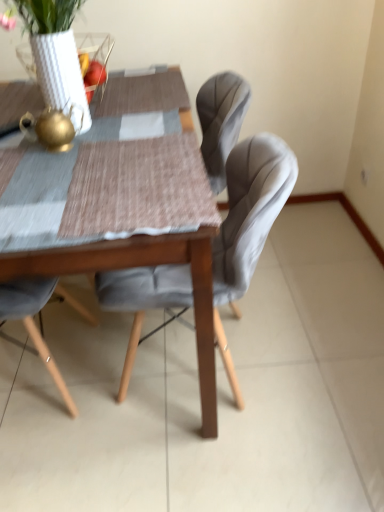
Question: Is white textured vase at upper left shorter than velvet grey chair at center?

Choices:
 (A) yes
 (B) no

Answer: (A)

Question: Is white textured vase at upper left directly adjacent to velvet grey chair at center?

Choices:
 (A) yes
 (B) no

Answer: (B)

Question: Can you confirm if white textured vase at upper left is positioned to the left of velvet grey chair at center?

Choices:
 (A) yes
 (B) no

Answer: (A)

Question: From the image's perspective, is white textured vase at upper left above velvet grey chair at center?

Choices:
 (A) no
 (B) yes

Answer: (B)

Question: Would you say white textured vase at upper left contains velvet grey chair at center?

Choices:
 (A) no
 (B) yes

Answer: (A)

Question: From a real-world perspective, is white textured vase at upper left over velvet grey chair at center?

Choices:
 (A) yes
 (B) no

Answer: (A)

Question: Would you say wooden table at center contains white textured vase at upper left?

Choices:
 (A) yes
 (B) no

Answer: (B)

Question: Does wooden table at center have a smaller size compared to white textured vase at upper left?

Choices:
 (A) no
 (B) yes

Answer: (A)

Question: Does wooden table at center come in front of white textured vase at upper left?

Choices:
 (A) no
 (B) yes

Answer: (B)

Question: From the image's perspective, does wooden table at center appear higher than white textured vase at upper left?

Choices:
 (A) no
 (B) yes

Answer: (A)

Question: Is wooden table at center positioned with its back to white textured vase at upper left?

Choices:
 (A) no
 (B) yes

Answer: (A)

Question: Is wooden table at center taller than white textured vase at upper left?

Choices:
 (A) yes
 (B) no

Answer: (A)

Question: Considering the relative positions of velvet grey chair at center and wooden table at center in the image provided, is velvet grey chair at center behind wooden table at center?

Choices:
 (A) yes
 (B) no

Answer: (A)